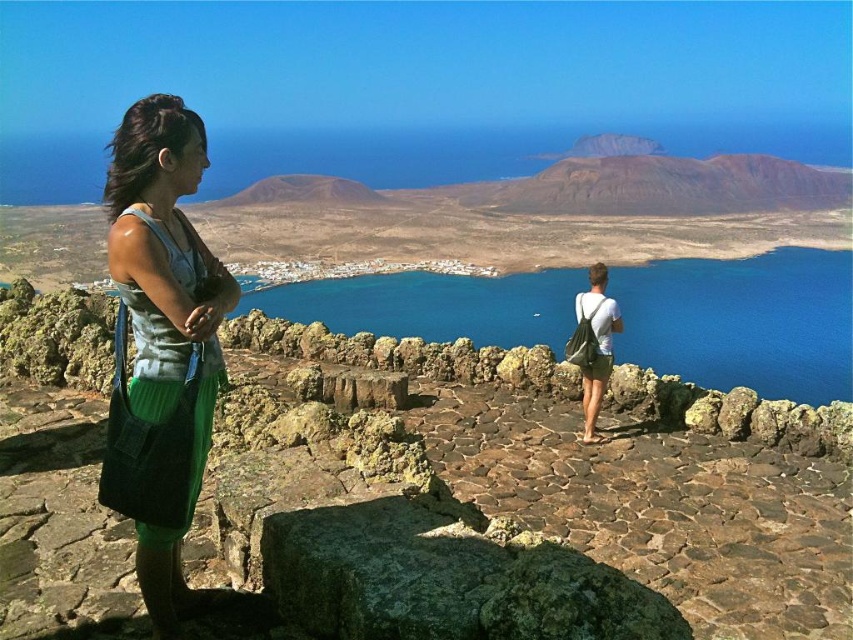
You are a tour guide leading a group to the viewpoint. You need to ensure that the group can walk safely between the rusty stone wall at center and the green corduroy skirt at left. The path is 4.86 meters between them. If the group requires a minimum of 3 meters for safe passage, can they pass safely?

The distance between the rusty stone wall at center and the green corduroy skirt at left is 4.86 meters, which exceeds the required 3 meters for safe passage. Therefore, the group can pass safely between them.

You are standing at the viewpoint and want to take a photo of the blue water at center and the green corduroy skirt at left. Which object should you frame first in your camera to ensure both are in the shot?

Since the blue water at center is to the right of the green corduroy skirt at left, you should first frame the green corduroy skirt at left to ensure both are included in the shot.